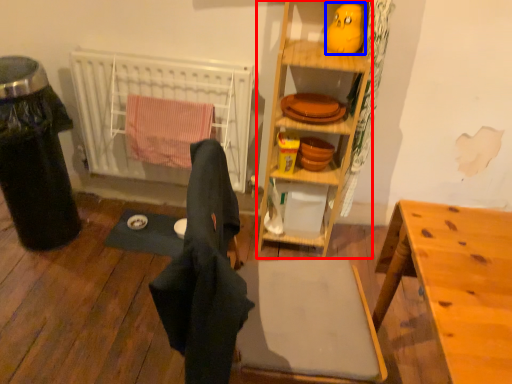
Question: Which point is closer to the camera, cabinetry (highlighted by a red box) or toy (highlighted by a blue box)?

Choices:
 (A) cabinetry
 (B) toy

Answer: (A)